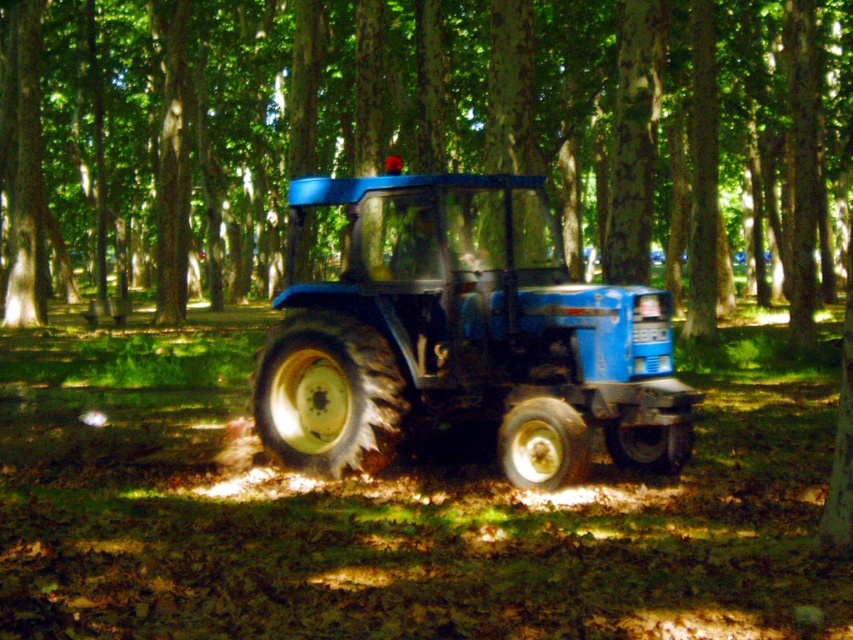
In the scene shown: You are a farmer who wants to park the matte blue tractor at center and the blue matte tractor at center side by side in a straight line. Based on the scene description, will both tractors fit within the width of the forest path they are currently on?

The matte blue tractor at center is wider than the blue matte tractor at center. Since the forest path width isn not specified in the scene description, it is impossible to determine if both tractors will fit side by side.

You are a farmer checking the positioning of your tractors in the woods. You notice two tractors labeled as matte blue tractor at center and blue matte tractor at center. Which one is actually present in the scene?

The matte blue tractor at center is the correct label because it is positioned over the blue matte tractor at center, indicating it is the visible one in the scene.